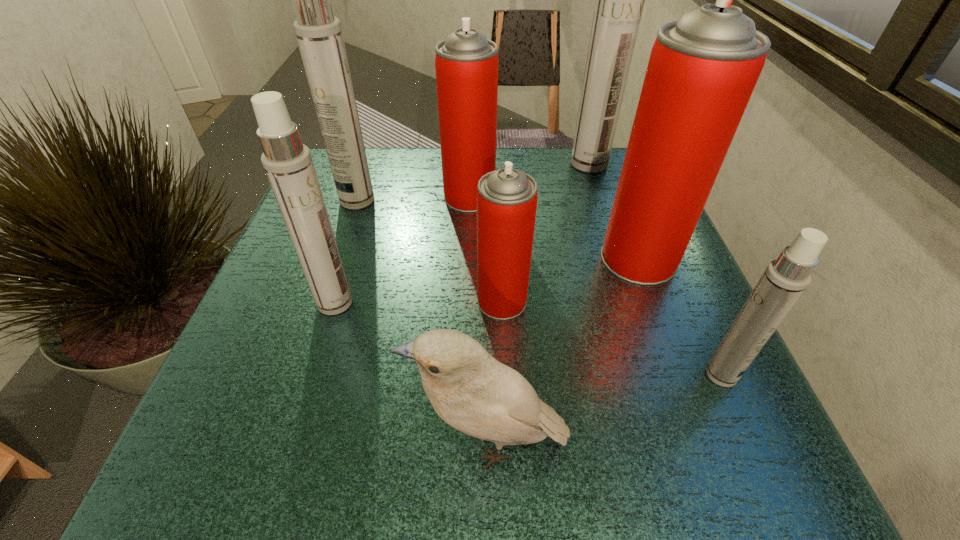
I want to click on the farthest object, so click(x=620, y=0).

The height and width of the screenshot is (540, 960). I want to click on the tallest aerosol can, so click(620, 0).

Identify the location of the third smallest white aerosol can. The height and width of the screenshot is (540, 960). (319, 35).

Locate an element on the screen. the biggest red aerosol can is located at coordinates (702, 70).

This screenshot has width=960, height=540. Identify the location of the second smallest red aerosol can. (466, 63).

Where is `the second smallest white aerosol can`? the second smallest white aerosol can is located at coordinates (288, 164).

You are a GUI agent. You are given a task and a screenshot of the screen. Output one action in this format:
    pyautogui.click(x=<x>, y=<y>)
    Task: Click on the smallest red aerosol can
    The image size is (960, 540).
    Given the screenshot: What is the action you would take?
    pyautogui.click(x=507, y=198)

Find the location of a particular element. This screenshot has width=960, height=540. the rightmost white aerosol can is located at coordinates (784, 280).

The image size is (960, 540). What are the coordinates of `the nearest aerosol can` in the screenshot? It's located at (784, 280).

Find the location of a particular element. the nearest object is located at coordinates (470, 390).